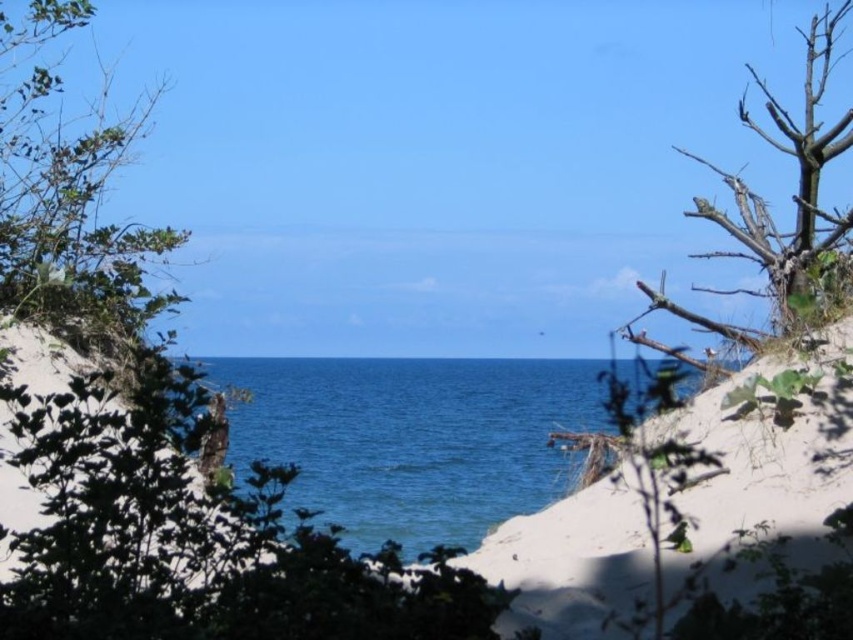
Question: Is the position of green leafy tree at left less distant than that of brown rough tree at right?

Choices:
 (A) yes
 (B) no

Answer: (A)

Question: Is blue water at center above brown rough tree at right?

Choices:
 (A) yes
 (B) no

Answer: (B)

Question: Does green leafy tree at left have a smaller size compared to brown rough tree at right?

Choices:
 (A) no
 (B) yes

Answer: (A)

Question: Which is nearer to the brown rough tree at right?

Choices:
 (A) blue water at center
 (B) green leafy tree at left

Answer: (B)

Question: Which of these objects is positioned farthest from the brown rough tree at right?

Choices:
 (A) blue water at center
 (B) green leafy tree at left

Answer: (A)

Question: Which of these objects is positioned farthest from the brown rough tree at right?

Choices:
 (A) green leafy tree at left
 (B) blue water at center

Answer: (B)